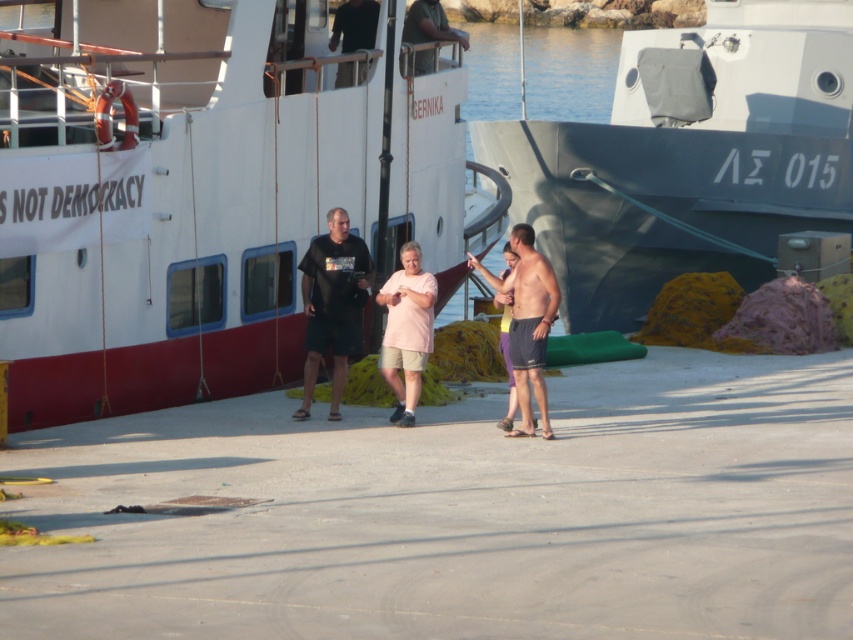
Question: Can you confirm if pink matte shorts at center is positioned below black matte shirt at upper center?

Choices:
 (A) yes
 (B) no

Answer: (A)

Question: Can you confirm if black matte t-shirt at center is smaller than black matte shirt at upper center?

Choices:
 (A) no
 (B) yes

Answer: (A)

Question: Is dark green fabric shirt at upper center bigger than pink fabric at center?

Choices:
 (A) no
 (B) yes

Answer: (A)

Question: Which point is closer to the camera taking this photo?

Choices:
 (A) (337, 86)
 (B) (258, 268)
 (C) (398, 280)
 (D) (306, 307)

Answer: (C)

Question: Which object is farther from the camera taking this photo?

Choices:
 (A) pink matte shorts at center
 (B) white matte boat at center

Answer: (A)

Question: Which point appears closest to the camera in this image?

Choices:
 (A) (425, 61)
 (B) (343, 77)
 (C) (360, 280)

Answer: (C)